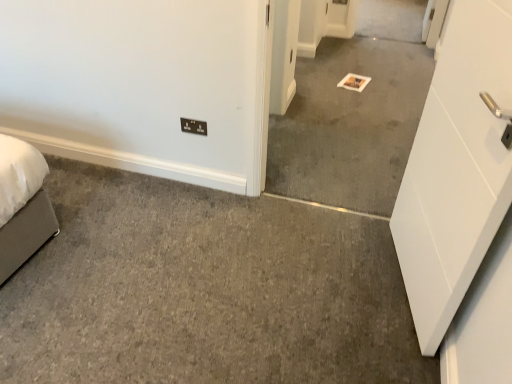
Measure the distance between black plastic/light switch at lower center and camera.

A distance of 2.21 meters exists between black plastic/light switch at lower center and camera.

Image resolution: width=512 pixels, height=384 pixels. What do you see at coordinates (193, 126) in the screenshot?
I see `black plastic/light switch at lower center` at bounding box center [193, 126].

I want to click on black plastic/light switch at lower center, so click(x=193, y=126).

Describe the element at coordinates (350, 124) in the screenshot. I see `gray carpet at center` at that location.

Image resolution: width=512 pixels, height=384 pixels. What are the coordinates of `gray carpet at center` in the screenshot? It's located at (350, 124).

Identify the location of black plastic/light switch at lower center. (193, 126).

Between black plastic/light switch at lower center and gray carpet at center, which one appears on the right side from the viewer's perspective?

gray carpet at center.

Considering the positions of objects black plastic/light switch at lower center and gray carpet at center in the image provided, who is in front, black plastic/light switch at lower center or gray carpet at center?

gray carpet at center.

Which is nearer, (x=193, y=124) or (x=364, y=114)?

Clearly, point (x=193, y=124) is closer to the camera than point (x=364, y=114).

From the image's perspective, is black plastic/light switch at lower center located beneath gray carpet at center?

Correct, black plastic/light switch at lower center appears lower than gray carpet at center in the image.

From a real-world perspective, is black plastic/light switch at lower center physically above gray carpet at center?

Actually, black plastic/light switch at lower center is physically below gray carpet at center in the real world.

From the picture: Can you confirm if black plastic/light switch at lower center is thinner than gray carpet at center?

Yes.

Who is shorter, black plastic/light switch at lower center or gray carpet at center?

Standing shorter between the two is black plastic/light switch at lower center.

Between black plastic/light switch at lower center and gray carpet at center, which one has smaller size?

black plastic/light switch at lower center.

Is gray carpet at center surrounded by black plastic/light switch at lower center?

No, gray carpet at center is not inside black plastic/light switch at lower center.

Are black plastic/light switch at lower center and gray carpet at center far apart?

Yes.

Does black plastic/light switch at lower center turn towards gray carpet at center?

No, black plastic/light switch at lower center is not oriented towards gray carpet at center.

What's the angular difference between black plastic/light switch at lower center and gray carpet at center's facing directions?

0.379 degrees.

How far apart are black plastic/light switch at lower center and gray carpet at center?

They are 1.29 meters apart.

Identify the location of light switch below the gray carpet at center (from the image's perspective). This screenshot has height=384, width=512. (193, 126).

Considering the positions of objects gray carpet at center and black plastic/light switch at lower center in the image provided, who is more to the right, gray carpet at center or black plastic/light switch at lower center?

Positioned to the right is gray carpet at center.

Is gray carpet at center in front of or behind black plastic/light switch at lower center in the image?

gray carpet at center is in front of black plastic/light switch at lower center.

Between point (292, 152) and point (186, 127), which one is positioned behind?

The point (292, 152) is farther from the camera.

From the image's perspective, is gray carpet at center above black plastic/light switch at lower center?

Yes, from the image's perspective, gray carpet at center is over black plastic/light switch at lower center.

From a real-world perspective, which is physically above, gray carpet at center or black plastic/light switch at lower center?

From a 3D spatial view, gray carpet at center is above.

Does gray carpet at center have a greater width compared to black plastic/light switch at lower center?

Yes, gray carpet at center is wider than black plastic/light switch at lower center.

Can you confirm if gray carpet at center is taller than black plastic/light switch at lower center?

Correct, gray carpet at center is much taller as black plastic/light switch at lower center.

Does gray carpet at center have a smaller size compared to black plastic/light switch at lower center?

Actually, gray carpet at center might be larger than black plastic/light switch at lower center.

Is gray carpet at center not inside black plastic/light switch at lower center?

Absolutely, gray carpet at center is external to black plastic/light switch at lower center.

Is gray carpet at center touching black plastic/light switch at lower center?

No, gray carpet at center is not beside black plastic/light switch at lower center.

Is black plastic/light switch at lower center at the back of gray carpet at center?

No.

Can you tell me how much gray carpet at center and black plastic/light switch at lower center differ in facing direction?

0.379 degrees.

Measure the distance between gray carpet at center and black plastic/light switch at lower center.

They are 1.29 meters apart.

The image size is (512, 384). Find the location of `light switch below the gray carpet at center (from the image's perspective)`. light switch below the gray carpet at center (from the image's perspective) is located at coordinates (193, 126).

This screenshot has width=512, height=384. In order to click on light switch to the left of gray carpet at center in this screenshot , I will do `click(193, 126)`.

Identify the location of concrete to the right of black plastic/light switch at lower center. This screenshot has width=512, height=384. (350, 124).